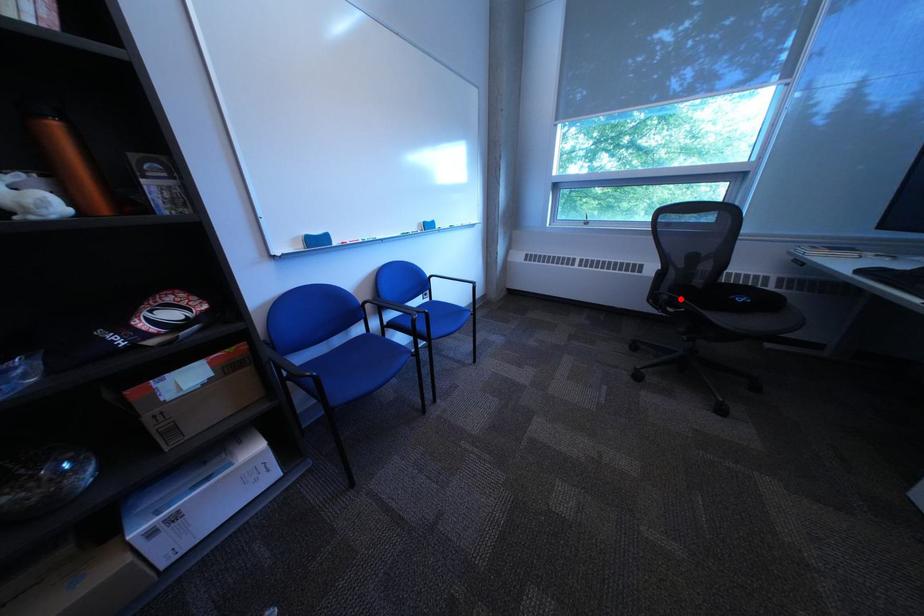
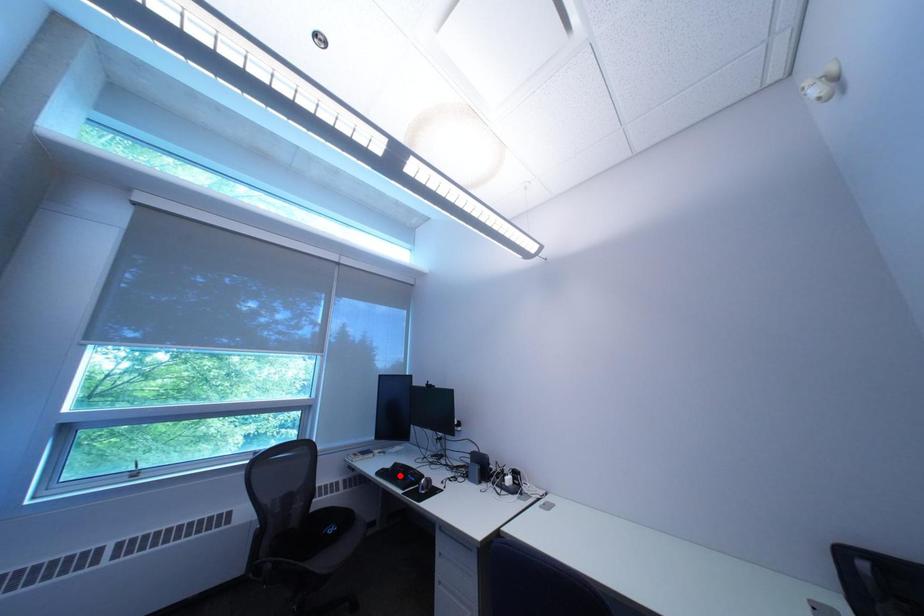
I am providing you with two images of the same scene from different viewpoints. A red point is marked on the first image and another point is marked on the second image. Is the red point in image1 aligned with the point shown in image2?

No